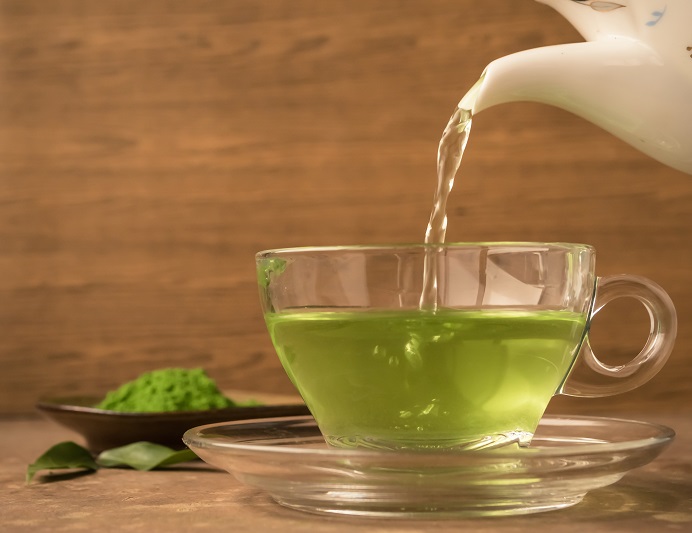
Find the location of a particular element. This screenshot has width=692, height=533. wooden wall is located at coordinates (182, 177).